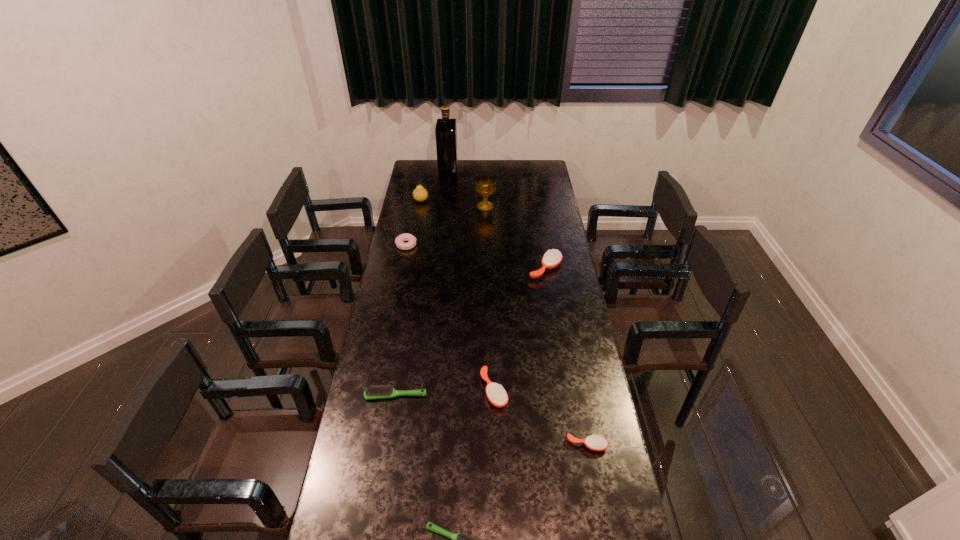
Find the location of a particular element. the tallest object is located at coordinates (446, 129).

Where is `the farthest object`? The width and height of the screenshot is (960, 540). the farthest object is located at coordinates (446, 129).

What are the coordinates of `the eighth shortest object` in the screenshot? It's located at (485, 185).

Locate an element on the screen. The height and width of the screenshot is (540, 960). pear is located at coordinates pyautogui.click(x=420, y=194).

This screenshot has width=960, height=540. I want to click on the biggest orange hairbrush, so click(x=552, y=258).

Where is `the fifth nearest object`? The image size is (960, 540). the fifth nearest object is located at coordinates point(552,258).

Locate an element on the screen. This screenshot has height=540, width=960. the leftmost orange hairbrush is located at coordinates (496, 394).

You are a GUI agent. You are given a task and a screenshot of the screen. Output one action in this format:
    pyautogui.click(x=<x>, y=<y>)
    Task: Click on the second nearest orange hairbrush
    
    Given the screenshot: What is the action you would take?
    pyautogui.click(x=496, y=394)

What are the coordinates of `purple doughnut` in the screenshot? It's located at (399, 241).

Identify the location of doughnut. Image resolution: width=960 pixels, height=540 pixels. (399, 241).